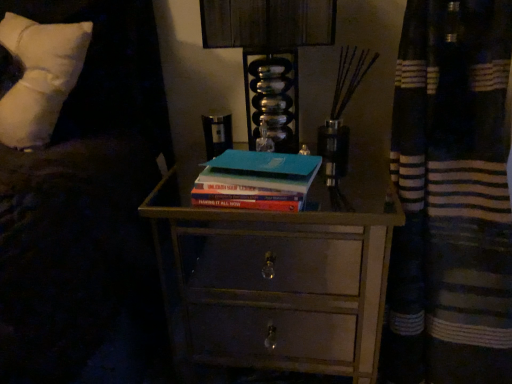
Question: Looking at the image, does white soft pillow at upper left seem bigger or smaller compared to teal matte book at center?

Choices:
 (A) big
 (B) small

Answer: (A)

Question: Would you say white soft pillow at upper left is to the left or to the right of teal matte book at center in the picture?

Choices:
 (A) left
 (B) right

Answer: (A)

Question: Estimate the real-world distances between objects in this image. Which object is farther from the wooden chest of drawers at center?

Choices:
 (A) white soft pillow at upper left
 (B) teal matte book at center
 (C) metallic glass at upper center

Answer: (A)

Question: Which is nearer to the metallic glass at upper center?

Choices:
 (A) white soft pillow at upper left
 (B) teal matte book at center
 (C) wooden chest of drawers at center

Answer: (B)